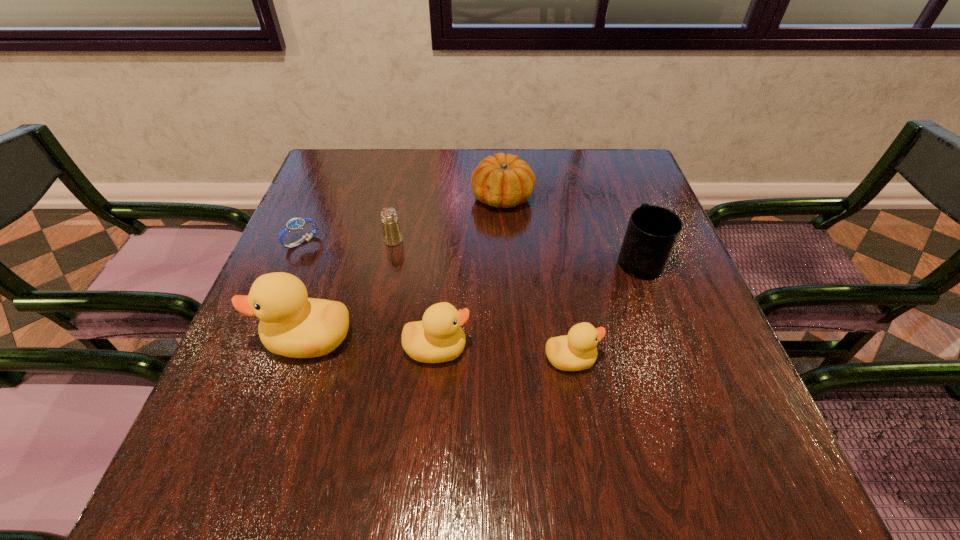
You are a GUI agent. You are given a task and a screenshot of the screen. Output one action in this format:
    pyautogui.click(x=<x>, y=<y>)
    Task: Click on the free space between the rightmost object and the gourd
    The image size is (960, 540).
    Given the screenshot: What is the action you would take?
    pyautogui.click(x=571, y=228)

This screenshot has width=960, height=540. What are the coordinates of `vacant area between the tallest duckling and the mug` in the screenshot? It's located at (473, 299).

At what (x,y) coordinates should I click in order to perform the action: click on free space between the third object from left to right and the rightmost object. Please return your answer as a coordinate pair (x, y). Looking at the image, I should click on (516, 250).

You are a GUI agent. You are given a task and a screenshot of the screen. Output one action in this format:
    pyautogui.click(x=<x>, y=<y>)
    Task: Click on the empty location between the leftmost duckling and the gourd
    This screenshot has width=960, height=540.
    Given the screenshot: What is the action you would take?
    pyautogui.click(x=405, y=268)

The width and height of the screenshot is (960, 540). In order to click on unoccupied area between the fifth object from right to left and the rightmost object in this screenshot , I will do `click(516, 250)`.

At what (x,y) coordinates should I click in order to perform the action: click on object that can be found as the fourth closest to the farthest object. Please return your answer as a coordinate pair (x, y). Image resolution: width=960 pixels, height=540 pixels. Looking at the image, I should click on (295, 224).

Locate which object is the third closest to the second duckling from left to right. Please provide its 2D coordinates. Your answer should be formatted as a tuple, i.e. [(x, y)], where the tuple contains the x and y coordinates of a point satisfying the conditions above.

[(392, 235)]

Identify which duckling is the second closest to the tallest object. Please provide its 2D coordinates. Your answer should be formatted as a tuple, i.e. [(x, y)], where the tuple contains the x and y coordinates of a point satisfying the conditions above.

[(576, 351)]

Identify the location of duckling that stands as the third closest to the rightmost object. This screenshot has height=540, width=960. (291, 324).